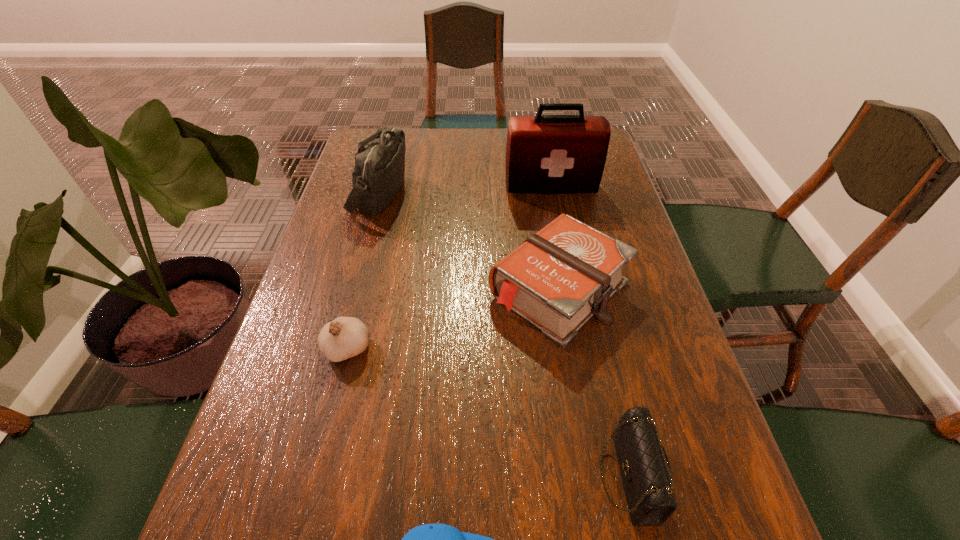
At what (x,y) coordinates should I click in order to perform the action: click on free point that satisfies the following two spatial constraints: 1. at the front padded panel of the garlic; 2. on the right side of the shoulder bag. Please return your answer as a coordinate pair (x, y). Looking at the image, I should click on (338, 349).

Where is `free space that satisfies the following two spatial constraints: 1. at the front padded panel of the garlic; 2. on the right side of the fifth shortest object`? free space that satisfies the following two spatial constraints: 1. at the front padded panel of the garlic; 2. on the right side of the fifth shortest object is located at coordinates (338, 349).

Where is `free location that satisfies the following two spatial constraints: 1. on the side of the first aid kit with the cross symbol; 2. at the front padded panel of the shoulder bag`? The height and width of the screenshot is (540, 960). free location that satisfies the following two spatial constraints: 1. on the side of the first aid kit with the cross symbol; 2. at the front padded panel of the shoulder bag is located at coordinates (552, 193).